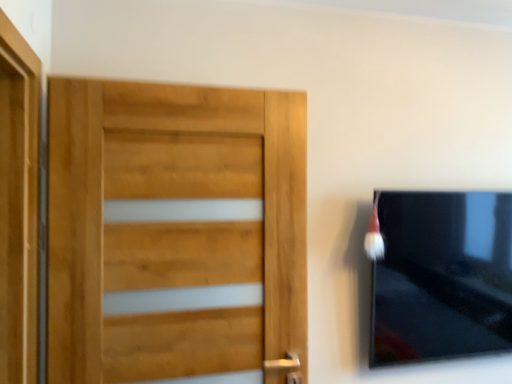
Question: From the image's perspective, does light brown wood door at left appear higher than matte black tv at right?

Choices:
 (A) yes
 (B) no

Answer: (A)

Question: Considering the relative sizes of light brown wood door at left and matte black tv at right in the image provided, is light brown wood door at left wider than matte black tv at right?

Choices:
 (A) no
 (B) yes

Answer: (A)

Question: Is matte black tv at right inside light brown wood door at left?

Choices:
 (A) no
 (B) yes

Answer: (A)

Question: Does light brown wood door at left have a smaller size compared to matte black tv at right?

Choices:
 (A) no
 (B) yes

Answer: (B)

Question: Is light brown wood door at left not within matte black tv at right?

Choices:
 (A) yes
 (B) no

Answer: (A)

Question: Is light brown wood door at left beside matte black tv at right?

Choices:
 (A) no
 (B) yes

Answer: (A)

Question: Is white fluffy brush at upper right at the back of matte black tv at right?

Choices:
 (A) no
 (B) yes

Answer: (A)

Question: Is matte black tv at right directly adjacent to white fluffy brush at upper right?

Choices:
 (A) yes
 (B) no

Answer: (B)

Question: Is matte black tv at right surrounding white fluffy brush at upper right?

Choices:
 (A) yes
 (B) no

Answer: (B)

Question: Is matte black tv at right shorter than white fluffy brush at upper right?

Choices:
 (A) yes
 (B) no

Answer: (B)

Question: Is matte black tv at right positioned in front of white fluffy brush at upper right?

Choices:
 (A) yes
 (B) no

Answer: (B)

Question: Is matte black tv at right further to camera compared to white fluffy brush at upper right?

Choices:
 (A) no
 (B) yes

Answer: (B)

Question: Is white fluffy brush at upper right outside light brown wood door at left?

Choices:
 (A) yes
 (B) no

Answer: (A)